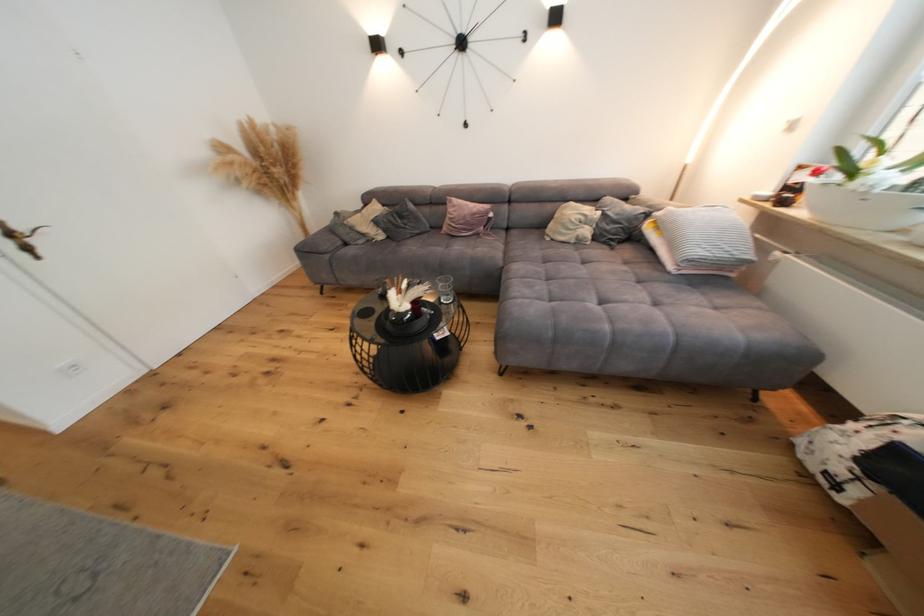
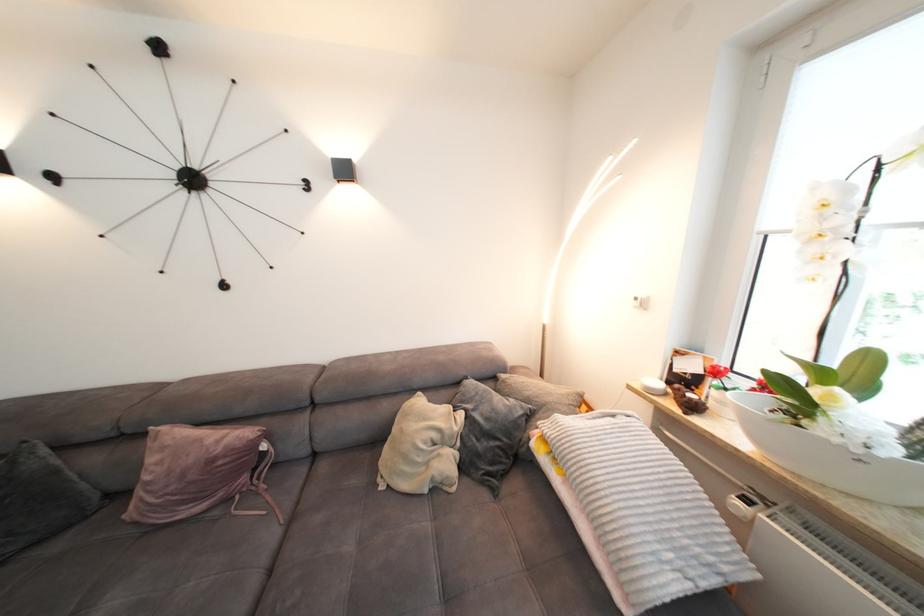
The point at (521, 233) is marked in the first image. Where is the corresponding point in the second image?

(330, 469)